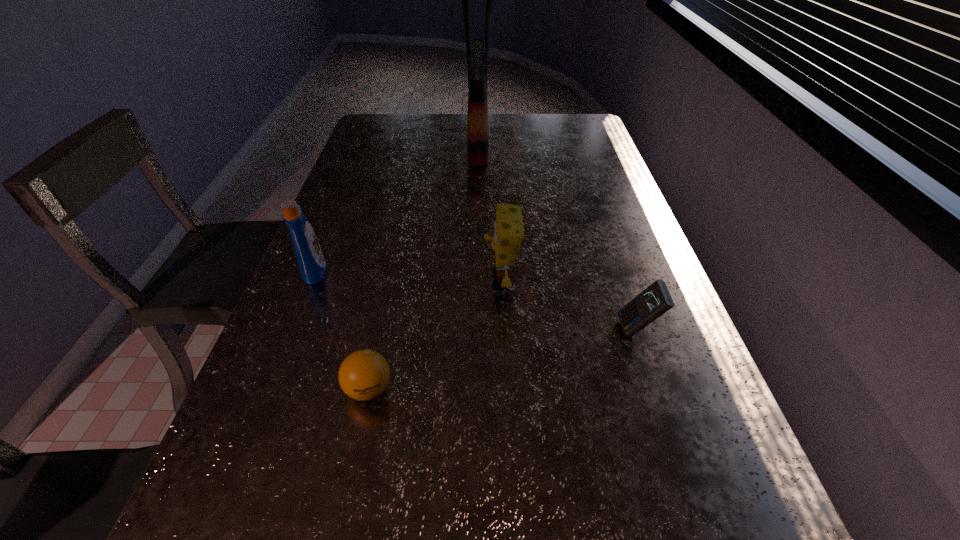
At what (x,y) coordinates should I click in order to perform the action: click on the farthest object. Please return your answer as a coordinate pair (x, y). The width and height of the screenshot is (960, 540). Looking at the image, I should click on (477, 55).

Identify the location of shopping bag. The image size is (960, 540). (477, 55).

This screenshot has width=960, height=540. Find the location of `the second tallest object`. the second tallest object is located at coordinates (308, 253).

The image size is (960, 540). What are the coordinates of `the leftmost object` in the screenshot? It's located at (308, 253).

Identify the location of sponge. (508, 229).

Find the location of a particular element. This screenshot has width=960, height=540. the rightmost object is located at coordinates (655, 300).

Identify the location of calculator. click(655, 300).

Identify the location of the shortest object. (364, 374).

Identify the location of ping-pong ball. This screenshot has height=540, width=960. (364, 374).

The height and width of the screenshot is (540, 960). Find the location of `vacant space located 0.350m on the front-facing side of the tallest object`. vacant space located 0.350m on the front-facing side of the tallest object is located at coordinates (592, 140).